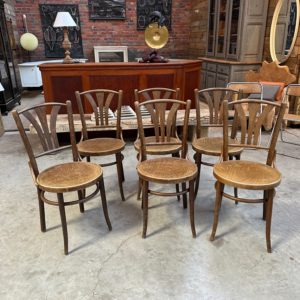
This screenshot has width=300, height=300. I want to click on wooden chair, so click(x=245, y=172), click(x=215, y=146), click(x=158, y=146), click(x=159, y=169), click(x=99, y=144), click(x=76, y=177).